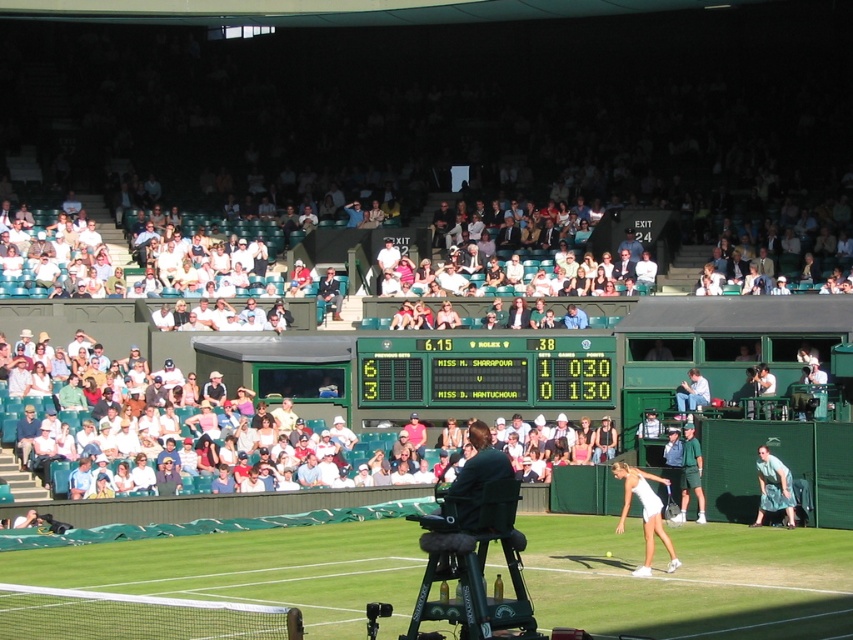
Question: Considering the real-world distances, which object is closest to the green plastic scoreboard at center?

Choices:
 (A) green fabric dress at lower right
 (B) green grass tennis court at center

Answer: (A)

Question: Which point is closer to the camera taking this photo?

Choices:
 (A) (764, 499)
 (B) (386, 388)
 (C) (619, 464)

Answer: (C)

Question: In this image, where is green grass tennis court at center located relative to green fabric dress at lower right?

Choices:
 (A) right
 (B) left

Answer: (B)

Question: Does white matte tennis racket at lower right have a lesser width compared to green fabric dress at lower right?

Choices:
 (A) yes
 (B) no

Answer: (B)

Question: Is white matte tennis racket at lower right to the left of green fabric dress at lower right from the viewer's perspective?

Choices:
 (A) yes
 (B) no

Answer: (A)

Question: Among these points, which one is nearest to the camera?

Choices:
 (A) (567, 573)
 (B) (453, 394)

Answer: (A)